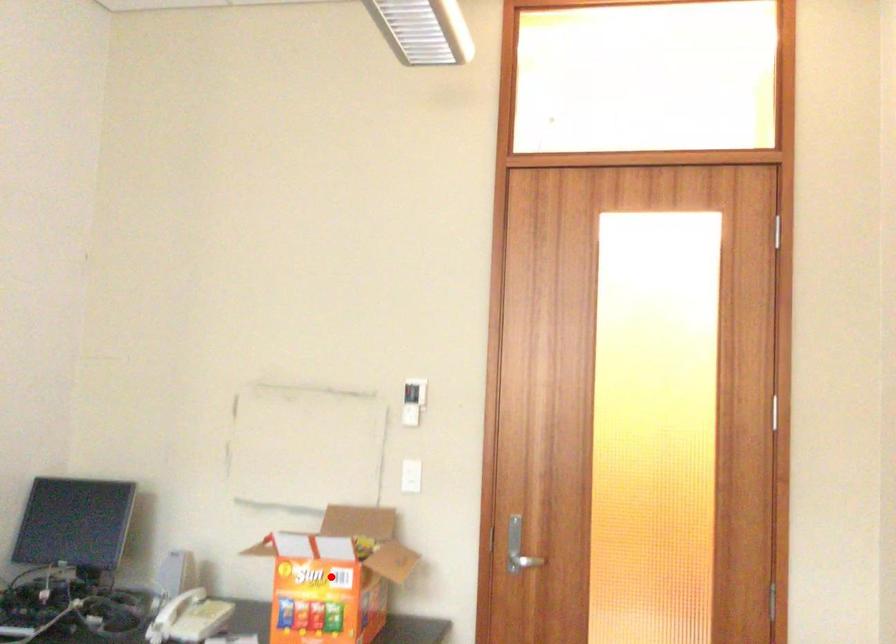
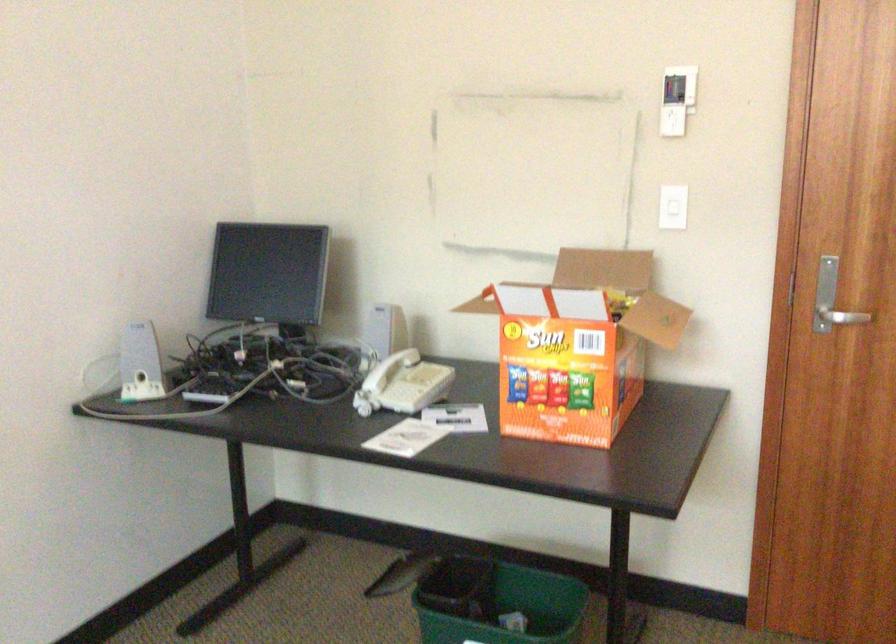
Where in the second image is the point corresponding to the highlighted location from the first image?

(578, 345)